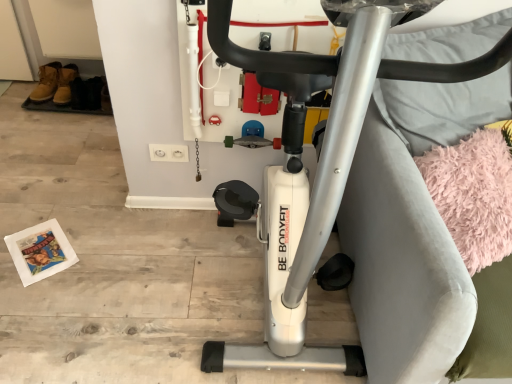
Question: Is pink fluffy yoga mat at right situated inside silver metallic stationary bicycle at center or outside?

Choices:
 (A) outside
 (B) inside

Answer: (A)

Question: Considering the positions of pink fluffy yoga mat at right and silver metallic stationary bicycle at center in the image, is pink fluffy yoga mat at right wider or thinner than silver metallic stationary bicycle at center?

Choices:
 (A) thin
 (B) wide

Answer: (A)

Question: From a real-world perspective, is pink fluffy yoga mat at right above or below silver metallic stationary bicycle at center?

Choices:
 (A) below
 (B) above

Answer: (A)

Question: Considering their positions, is silver metallic stationary bicycle at center located in front of or behind pink fluffy yoga mat at right?

Choices:
 (A) front
 (B) behind

Answer: (A)

Question: From a real-world perspective, is silver metallic stationary bicycle at center above or below pink fluffy yoga mat at right?

Choices:
 (A) above
 (B) below

Answer: (A)

Question: Considering the relative positions of silver metallic stationary bicycle at center and pink fluffy yoga mat at right in the image provided, is silver metallic stationary bicycle at center to the left or to the right of pink fluffy yoga mat at right?

Choices:
 (A) left
 (B) right

Answer: (A)

Question: Does point (335, 185) appear closer or farther from the camera than point (505, 125)?

Choices:
 (A) closer
 (B) farther

Answer: (A)